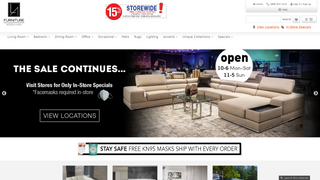
Where is `rug`? The height and width of the screenshot is (180, 320). rug is located at coordinates (201, 123).